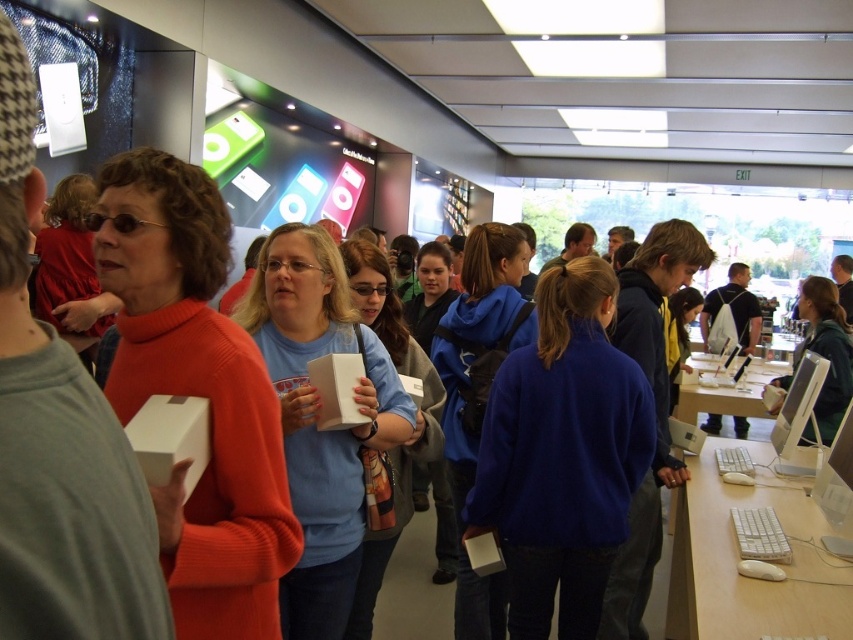
You are a customer standing at the entrance of the electronics store. You want to pick up the royal blue sweater at center from the counter. Can you reach it without moving closer than your current position?

The royal blue sweater at center is 1.94 meters from the camera, so you cannot reach it without moving closer than your current position.

You are a customer in the electronics store and want to see the white matte box at center. Is the royal blue sweater at center blocking your view of it?

The white matte box at center is behind the royal blue sweater at center, so yes, the royal blue sweater at center is blocking the view of the white matte box at center.